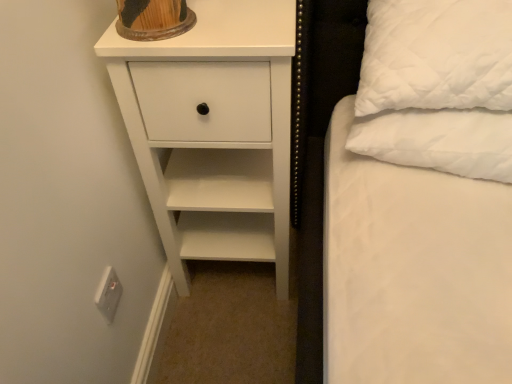
Question: Considering the relative sizes of white quilted pillow at right and white matte chest of drawers at upper left in the image provided, is white quilted pillow at right thinner than white matte chest of drawers at upper left?

Choices:
 (A) yes
 (B) no

Answer: (A)

Question: Can you confirm if white quilted pillow at right is positioned to the right of white matte chest of drawers at upper left?

Choices:
 (A) yes
 (B) no

Answer: (A)

Question: Does white quilted pillow at right have a larger size compared to white matte chest of drawers at upper left?

Choices:
 (A) no
 (B) yes

Answer: (A)

Question: Does white quilted pillow at right have a smaller size compared to white matte chest of drawers at upper left?

Choices:
 (A) no
 (B) yes

Answer: (B)

Question: From a real-world perspective, is white quilted pillow at right on white matte chest of drawers at upper left?

Choices:
 (A) no
 (B) yes

Answer: (B)

Question: Does white quilted pillow at right have a greater width compared to white matte chest of drawers at upper left?

Choices:
 (A) no
 (B) yes

Answer: (A)

Question: Is white plastic electric outlet at lower left thinner than white quilted pillow at right?

Choices:
 (A) yes
 (B) no

Answer: (A)

Question: Does white plastic electric outlet at lower left appear on the left side of white quilted pillow at right?

Choices:
 (A) yes
 (B) no

Answer: (A)

Question: Can you confirm if white plastic electric outlet at lower left is shorter than white quilted pillow at right?

Choices:
 (A) yes
 (B) no

Answer: (A)

Question: Is white plastic electric outlet at lower left at the right side of white quilted pillow at right?

Choices:
 (A) yes
 (B) no

Answer: (B)

Question: Does white plastic electric outlet at lower left have a smaller size compared to white quilted pillow at right?

Choices:
 (A) yes
 (B) no

Answer: (A)

Question: From the image's perspective, would you say white plastic electric outlet at lower left is shown under white quilted pillow at right?

Choices:
 (A) yes
 (B) no

Answer: (A)

Question: Is white plastic electric outlet at lower left outside white matte chest of drawers at upper left?

Choices:
 (A) no
 (B) yes

Answer: (B)